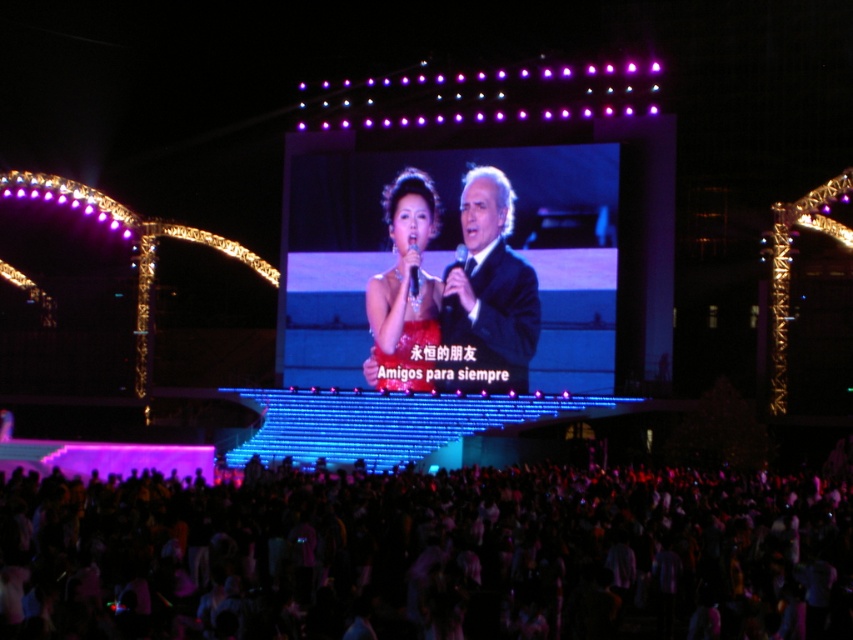
Who is taller, black fabric crowd at lower center or shiny red dress at center?

With more height is shiny red dress at center.

Can you confirm if black fabric crowd at lower center is positioned to the left of shiny red dress at center?

No, black fabric crowd at lower center is not to the left of shiny red dress at center.

Identify the location of black fabric crowd at lower center. (431, 556).

In the scene shown: Can you confirm if black satin suit at center is shorter than black plastic microphone at center?

No, black satin suit at center is not shorter than black plastic microphone at center.

Is point (523, 268) farther from camera compared to point (444, 296)?

No, (523, 268) is closer to viewer.

Is point (462, 292) behind point (456, 262)?

No, it is not.

Where is `black satin suit at center`? Image resolution: width=853 pixels, height=640 pixels. black satin suit at center is located at coordinates (490, 285).

Who is positioned more to the right, shiny red dress at center or black plastic microphone at center?

black plastic microphone at center is more to the right.

Based on the photo, which is above, shiny red dress at center or black plastic microphone at center?

black plastic microphone at center

What do you see at coordinates (404, 289) in the screenshot? The height and width of the screenshot is (640, 853). I see `shiny red dress at center` at bounding box center [404, 289].

I want to click on shiny red dress at center, so click(404, 289).